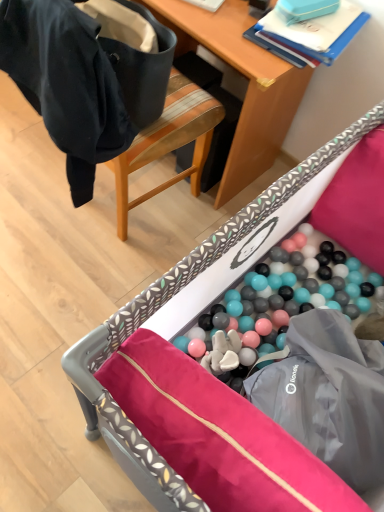
Find the location of a particular element. This screenshot has width=384, height=512. vacant space that's between black fabric chair at upper left and wooden desk at upper center is located at coordinates coord(173,226).